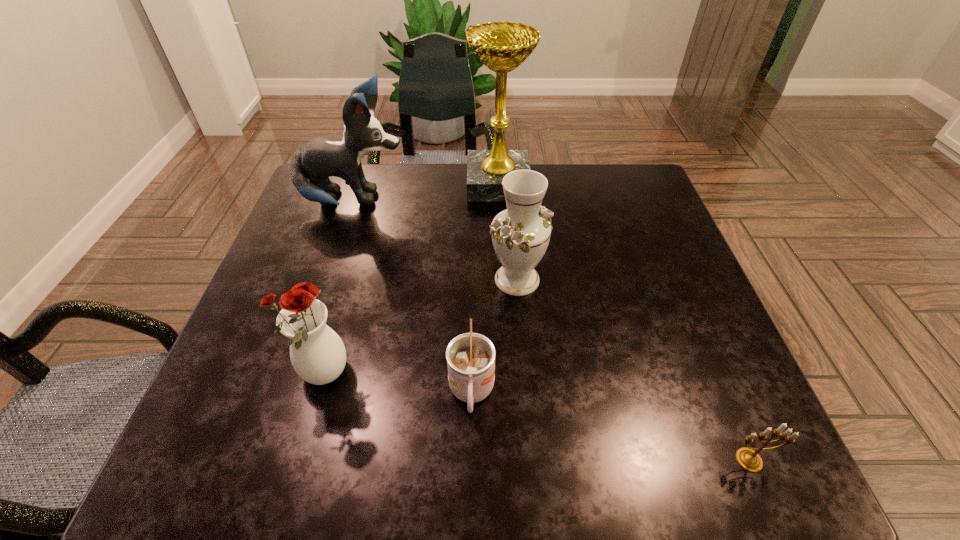
The height and width of the screenshot is (540, 960). Find the location of `free space between the candelabrum and the cup`. free space between the candelabrum and the cup is located at coordinates (611, 427).

You are a GUI agent. You are given a task and a screenshot of the screen. Output one action in this format:
    pyautogui.click(x=<x>, y=<y>)
    Task: Click on the free spot between the left vase and the farther vase
    The width and height of the screenshot is (960, 540).
    Given the screenshot: What is the action you would take?
    pyautogui.click(x=420, y=328)

The height and width of the screenshot is (540, 960). In order to click on the fifth closest object to the left vase in this screenshot , I will do `click(748, 459)`.

This screenshot has width=960, height=540. Identify the location of object that ranks as the fifth closest to the second tallest object. (748, 459).

The image size is (960, 540). Identify the location of vacant area that satisfies the following two spatial constraints: 1. on the front-facing side of the nearer vase; 2. on the right side of the fifth shortest object. (297, 375).

The height and width of the screenshot is (540, 960). What are the coordinates of `free spot that satisfies the following two spatial constraints: 1. on the front side of the farther vase; 2. on the right side of the candelabrum` in the screenshot? It's located at (532, 460).

You are a GUI agent. You are given a task and a screenshot of the screen. Output one action in this format:
    pyautogui.click(x=<x>, y=<y>)
    Task: Click on the free region that satisfies the following two spatial constraints: 1. on the front-facing side of the tallest object; 2. on the side with the handle of the cup
    Image resolution: width=960 pixels, height=540 pixels.
    Given the screenshot: What is the action you would take?
    pyautogui.click(x=509, y=393)

Locate an element on the screen. The width and height of the screenshot is (960, 540). vacant space that satisfies the following two spatial constraints: 1. on the front-facing side of the right vase; 2. on the right side of the puppy is located at coordinates (328, 280).

At what (x,y) coordinates should I click in order to perform the action: click on free spot that satisfies the following two spatial constraints: 1. on the front-facing side of the puppy; 2. on the back side of the right vase. Please return your answer as a coordinate pair (x, y). This screenshot has width=960, height=540. Looking at the image, I should click on (328, 280).

Where is `vacant region that satisfies the following two spatial constraints: 1. on the front-facing side of the tallest object; 2. on the right side of the farther vase`? vacant region that satisfies the following two spatial constraints: 1. on the front-facing side of the tallest object; 2. on the right side of the farther vase is located at coordinates (503, 280).